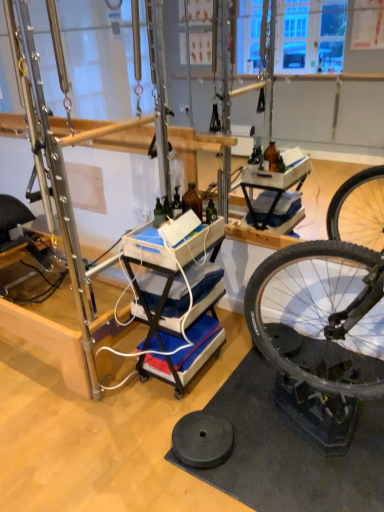
This screenshot has height=512, width=384. What do you see at coordinates (177, 298) in the screenshot?
I see `wooden tray at center` at bounding box center [177, 298].

Identify the location of wooden tray at center. (177, 298).

Measure the distance between wooden tray at center and camera.

The distance of wooden tray at center from camera is 1.62 meters.

I want to click on wooden tray at center, so click(x=177, y=298).